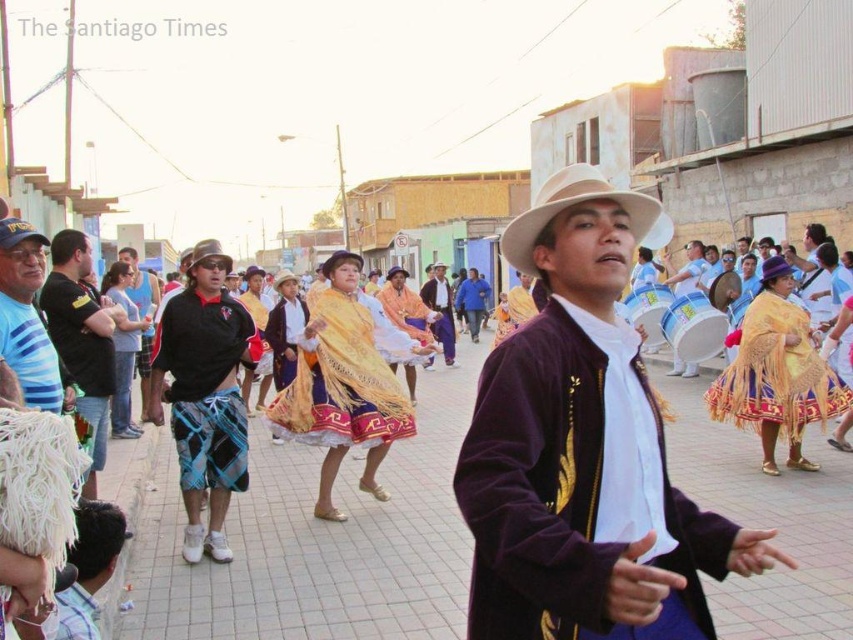
Question: Which of the following is the farthest from the observer?

Choices:
 (A) (479, 316)
 (B) (206, 305)
 (C) (590, 186)
 (D) (225, 253)

Answer: (A)

Question: Which of the following is the closest to the observer?

Choices:
 (A) matte gold drum at center
 (B) light blue shirt at lower left

Answer: (B)

Question: Is black mesh shorts at left to the right of brown leather jacket at center from the viewer's perspective?

Choices:
 (A) yes
 (B) no

Answer: (B)

Question: Does purple velvet jacket at center have a greater width compared to black plaid shorts at center?

Choices:
 (A) yes
 (B) no

Answer: (A)

Question: Which point is closer to the camera?

Choices:
 (A) striped fabric shirt at left
 (B) light blue shirt at lower left
 (C) gold fringed skirt at right

Answer: (B)

Question: Does black mesh shorts at left come in front of matte gold drum at center?

Choices:
 (A) no
 (B) yes

Answer: (B)